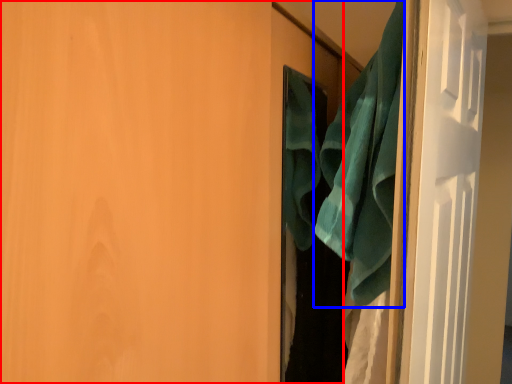
Question: Which point is further to the camera, door (highlighted by a red box) or beach towel (highlighted by a blue box)?

Choices:
 (A) door
 (B) beach towel

Answer: (B)